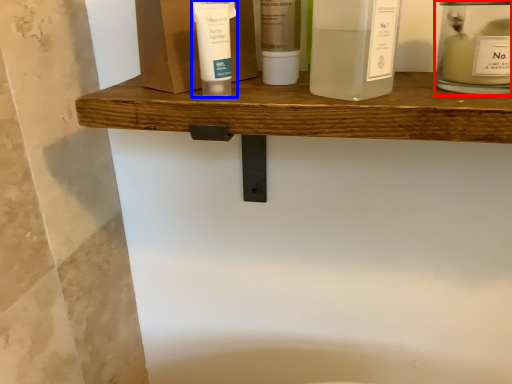
Question: Among these objects, which one is farthest to the camera, toiletry (highlighted by a red box) or toiletry (highlighted by a blue box)?

Choices:
 (A) toiletry
 (B) toiletry

Answer: (B)